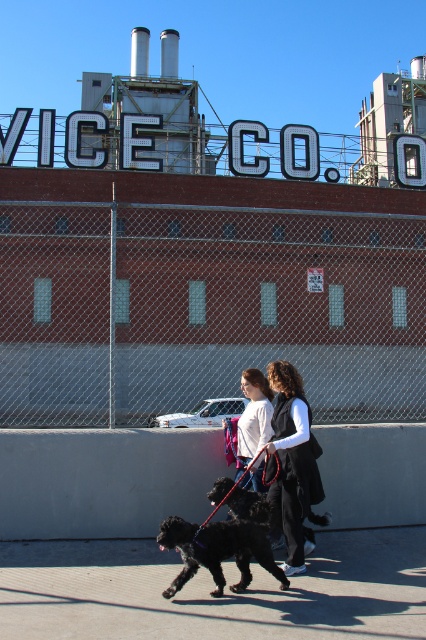
From the picture: You are a photographer trying to capture a clear photo of the black silky dog at center without the black fabric vest at center blocking it. Is the vest currently in front of the dog?

The black fabric vest at center is positioned over the black silky dog at center, meaning the vest is blocking the dog. To get a clear shot, you need to adjust your angle or wait for them to move so the vest is no longer in front.

You are a delivery person who needs to deliver a package to the black fabric vest at center. The delivery requires you to stand exactly at the coordinates provided in the scene description. Can you confirm if the coordinates are within the visible area of the scene?

The coordinates for the black fabric vest at center are at point (x=293, y=461), which is within the visible area of the scene as described.